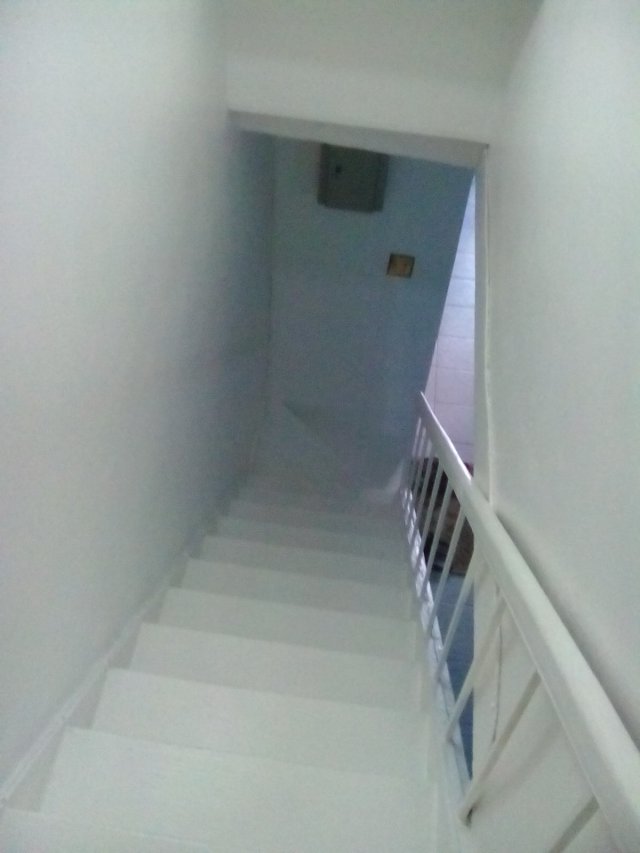
Identify the location of tiled floor. (461, 358).